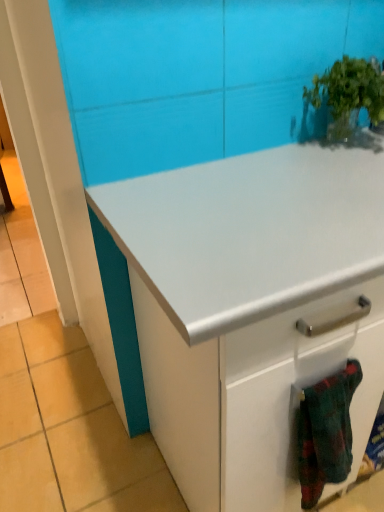
Question: In the image, is white glossy cabinet at center positioned in front of or behind flannel fabric blanket at lower right?

Choices:
 (A) behind
 (B) front

Answer: (B)

Question: Does point (231, 443) appear closer or farther from the camera than point (334, 399)?

Choices:
 (A) farther
 (B) closer

Answer: (A)

Question: Which is farther from the green leafy plant at upper right?

Choices:
 (A) flannel fabric blanket at lower right
 (B) white glossy cabinet at center

Answer: (A)

Question: Which is nearer to the green leafy plant at upper right?

Choices:
 (A) white glossy cabinet at center
 (B) flannel fabric blanket at lower right

Answer: (A)